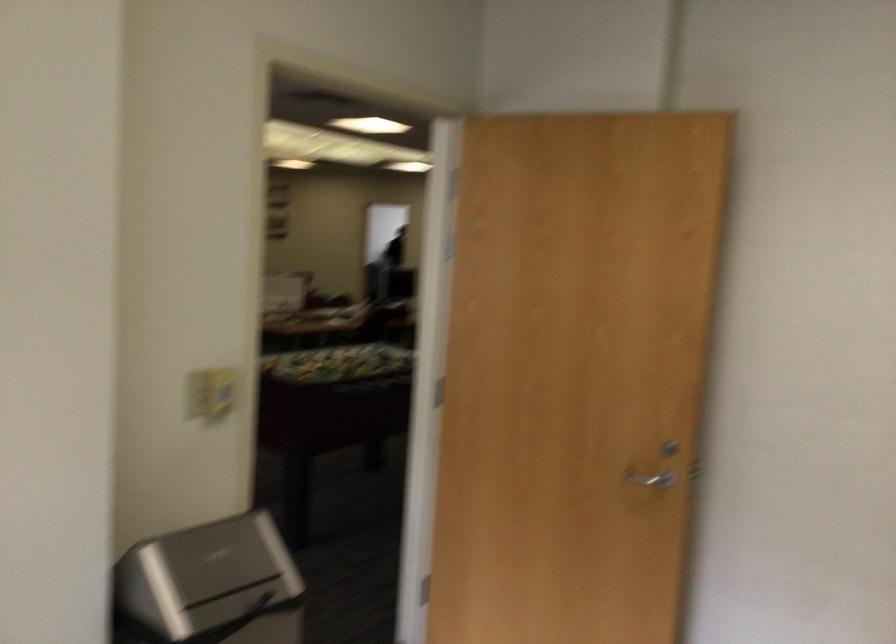
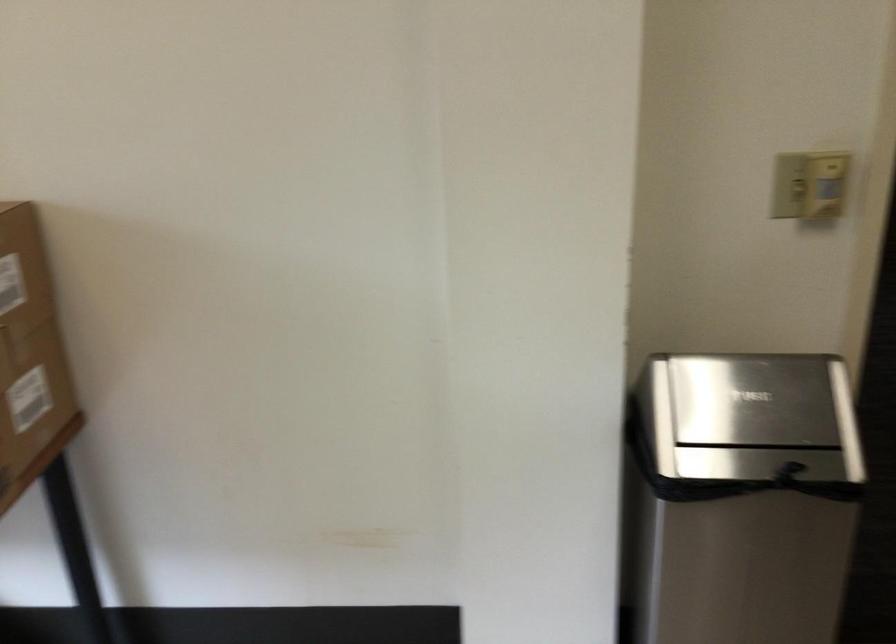
Question: Based on the continuous images, in which direction is the camera rotating? Reply with the corresponding letter.

Choices:
 (A) Left
 (B) Right
 (C) Up
 (D) Down

Answer: (A)